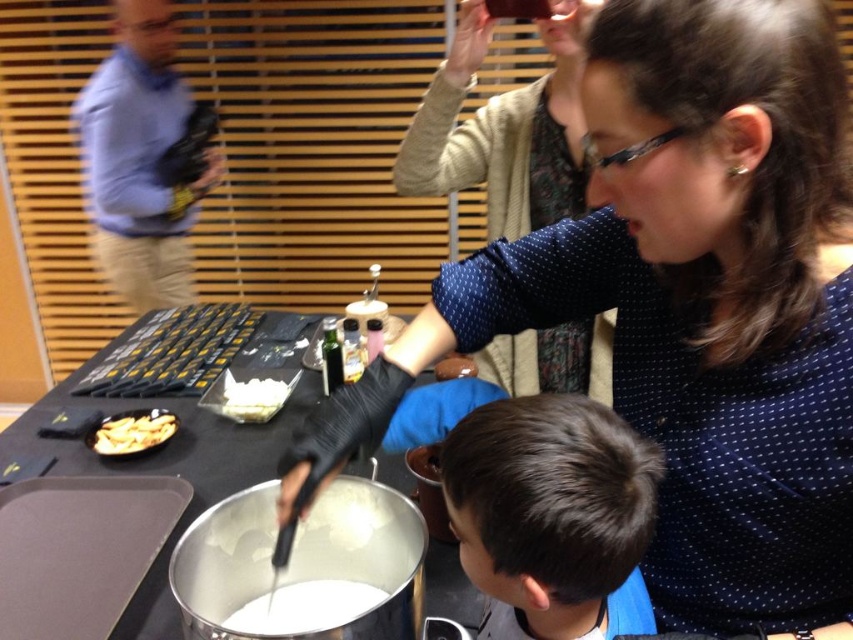
Does point (173, 419) come in front of point (231, 412)?

Yes.

Who is positioned more to the right, yellow crispy chips at lower left or white creamy substance at center?

white creamy substance at center

Who is more forward, (160, 440) or (263, 381)?

Positioned in front is point (160, 440).

Where is `yellow crispy chips at lower left`? This screenshot has width=853, height=640. yellow crispy chips at lower left is located at coordinates (132, 433).

Is blue shirt at left below white creamy substance at center?

No, blue shirt at left is not below white creamy substance at center.

Who is more distant from viewer, (148, 195) or (254, 397)?

The point (148, 195) is behind.

Is point (143, 204) less distant than point (263, 396)?

That is False.

Identify the location of blue shirt at left. (140, 161).

Does matte black shirt at center have a smaller size compared to yellow crispy chips at lower left?

Actually, matte black shirt at center might be larger than yellow crispy chips at lower left.

Does point (670, 307) come in front of point (125, 440)?

Yes, point (670, 307) is in front of point (125, 440).

Find the location of a particular element. Image resolution: width=853 pixels, height=640 pixels. matte black shirt at center is located at coordinates (693, 304).